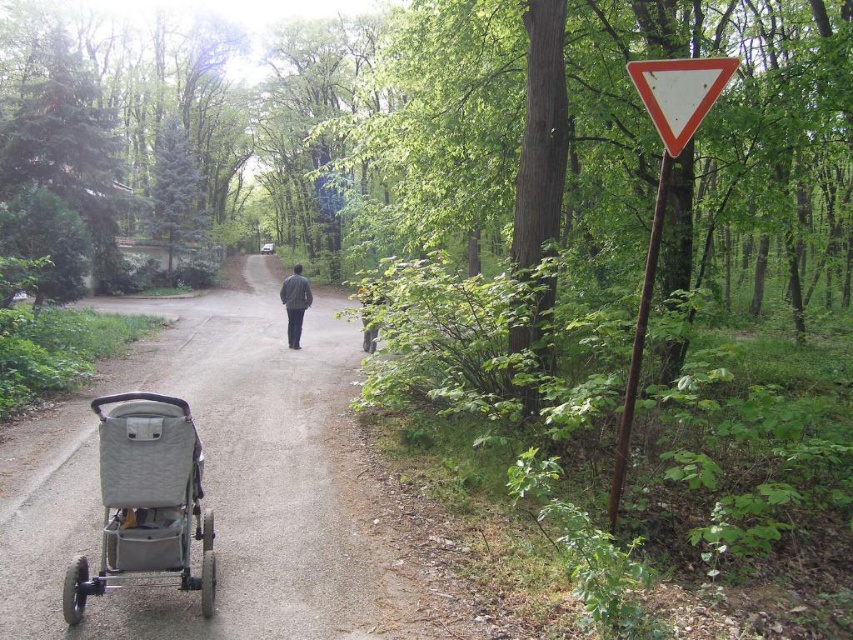
Question: Can you confirm if gray fabric stroller at lower left is bigger than white plastic triangle at upper right?

Choices:
 (A) yes
 (B) no

Answer: (A)

Question: Can you confirm if white plastic triangle at right is thinner than white plastic triangle at upper right?

Choices:
 (A) no
 (B) yes

Answer: (B)

Question: Estimate the real-world distances between objects in this image. Which object is closer to the gray fabric stroller at lower left?

Choices:
 (A) dark gray jacket at center
 (B) gray fabric baby carriage at lower left
 (C) white plastic triangle at right

Answer: (B)

Question: Which of these objects is positioned closest to the dark gray jacket at center?

Choices:
 (A) white plastic triangle at right
 (B) gray fabric baby carriage at lower left

Answer: (A)

Question: Which object appears closest to the camera in this image?

Choices:
 (A) white plastic triangle at right
 (B) gray fabric baby carriage at lower left
 (C) gray fabric stroller at lower left

Answer: (B)

Question: Does gray fabric baby carriage at lower left appear over dark gray jacket at center?

Choices:
 (A) no
 (B) yes

Answer: (A)